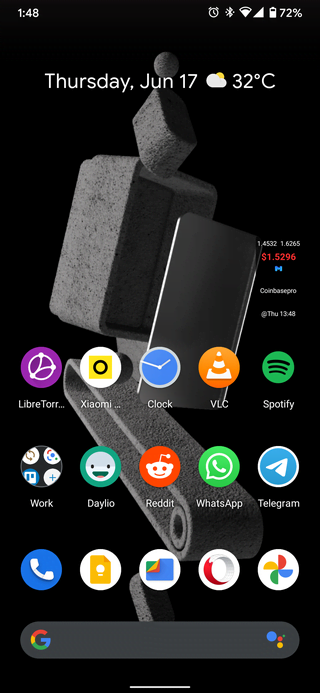
The height and width of the screenshot is (693, 320). I want to click on temperature display, so click(x=239, y=80).